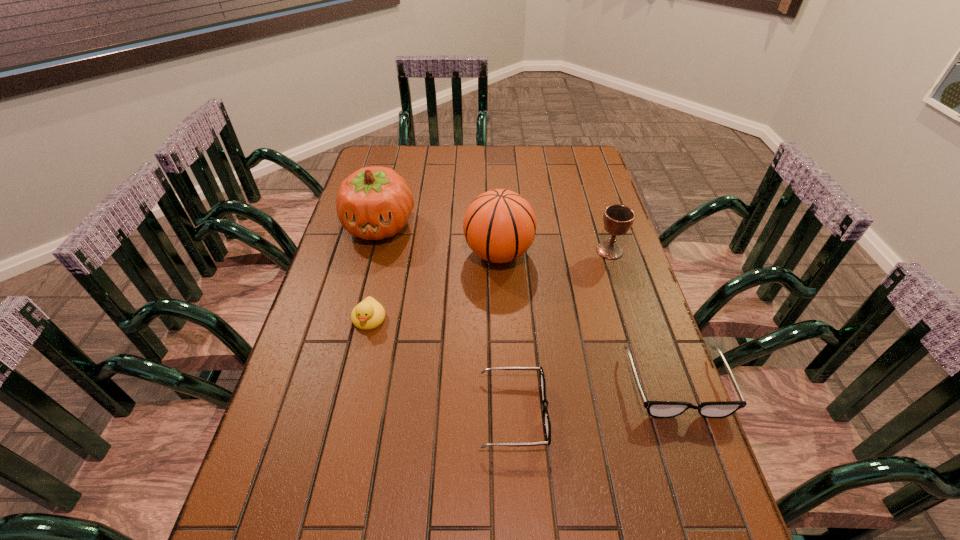
Please point a spot on the left to add another spectacles. Please provide its 2D coordinates. Your answer should be formatted as a tuple, i.e. [(x, y)], where the tuple contains the x and y coordinates of a point satisfying the conditions above.

[(332, 444)]